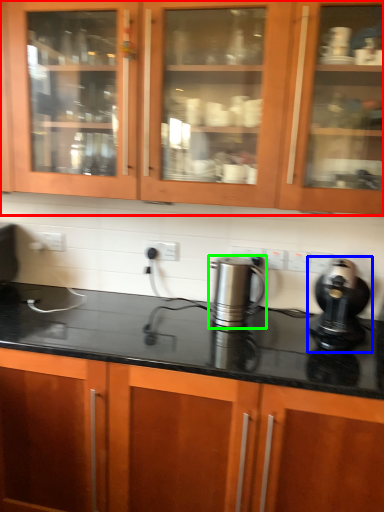
Question: Based on their relative distances, which object is farther from cabinetry (highlighted by a red box)? Choose from home appliance (highlighted by a blue box) and kitchen appliance (highlighted by a green box).

Choices:
 (A) home appliance
 (B) kitchen appliance

Answer: (A)